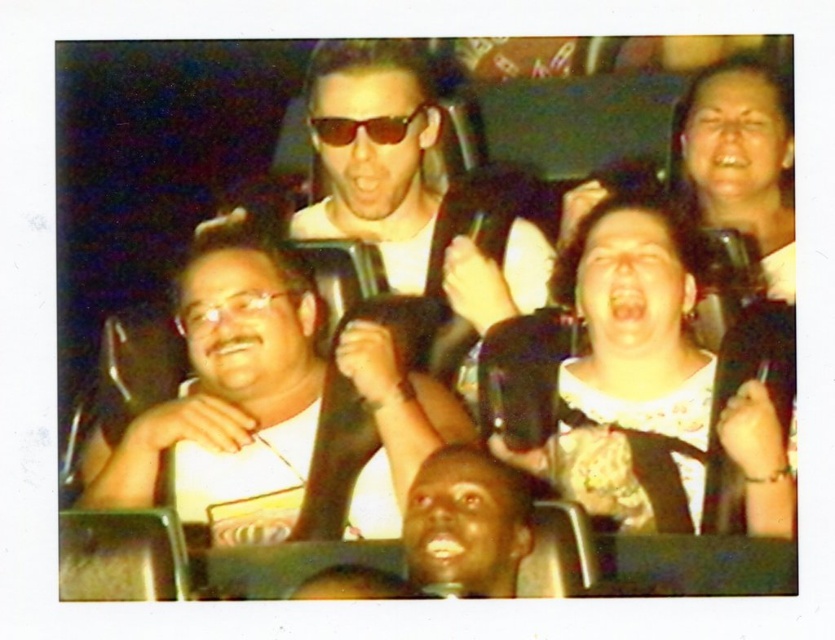
Which of these two, white matte shirt at center or shiny black sunglasses at center, stands shorter?

shiny black sunglasses at center

Is point (413, 384) positioned before point (368, 131)?

Yes, point (413, 384) is in front of point (368, 131).

This screenshot has width=835, height=640. I want to click on white matte shirt at center, so click(225, 384).

This screenshot has height=640, width=835. Find the location of `white matte shirt at center`. white matte shirt at center is located at coordinates (225, 384).

Is white matte shirt at center to the right of white lace blouse at center from the viewer's perspective?

In fact, white matte shirt at center is to the left of white lace blouse at center.

Between point (307, 332) and point (611, 209), which one is positioned in front?

Positioned in front is point (611, 209).

The image size is (835, 640). Find the location of `white matte shirt at center`. white matte shirt at center is located at coordinates (225, 384).

Image resolution: width=835 pixels, height=640 pixels. Find the location of `white matte shirt at center`. white matte shirt at center is located at coordinates (225, 384).

Identify the location of white matte shirt at center. The image size is (835, 640). (225, 384).